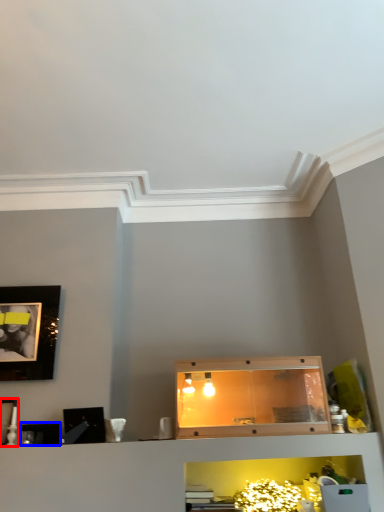
Question: Which point is further to the camera, picture frame (highlighted by a red box) or picture frame (highlighted by a blue box)?

Choices:
 (A) picture frame
 (B) picture frame

Answer: (B)